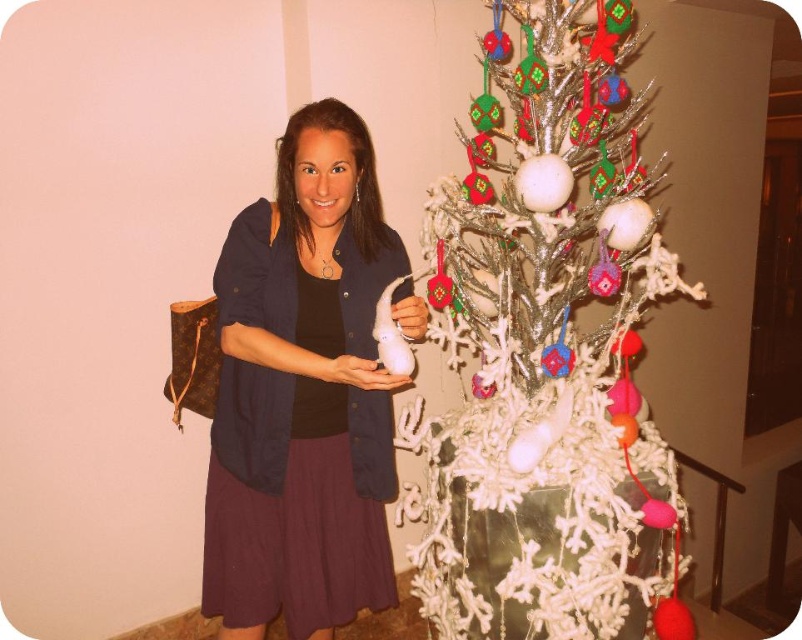
You are a visitor at a holiday exhibition and want to take a photo of the white textured christmas tree at center without getting too close. If your camera has a maximum zoom of 10x, which allows you to focus clearly on objects up to 2 meters away, can you take a clear photo of the tree from your current position?

The white textured christmas tree at center is 1.66 meters away from viewer, which is within the 2 meter range of your camera. Yes, you can take a clear photo of the white textured christmas tree at center from your current position using the camera.

You are standing in the room with the woman and the Christmas tree. You need to place a new ornament exactly between the two points labeled point (614, 296) and point (310, 220). Based on their positions, which point is closer to the front of the room?

Point (310, 220) is closer to the front of the room because it is in front of point (614, 296), which is behind it.